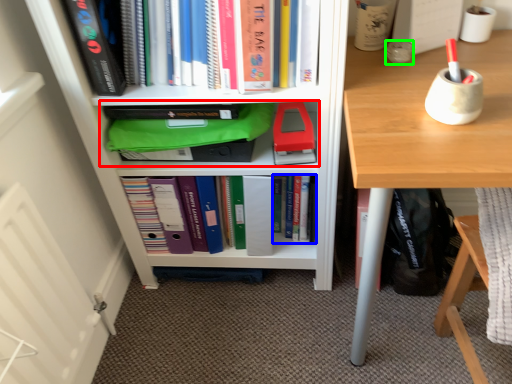
Question: Estimate the real-world distances between objects in this image. Which object is closer to shelf (highlighted by a red box), book (highlighted by a blue box) or stationery (highlighted by a green box)?

Choices:
 (A) book
 (B) stationery

Answer: (A)